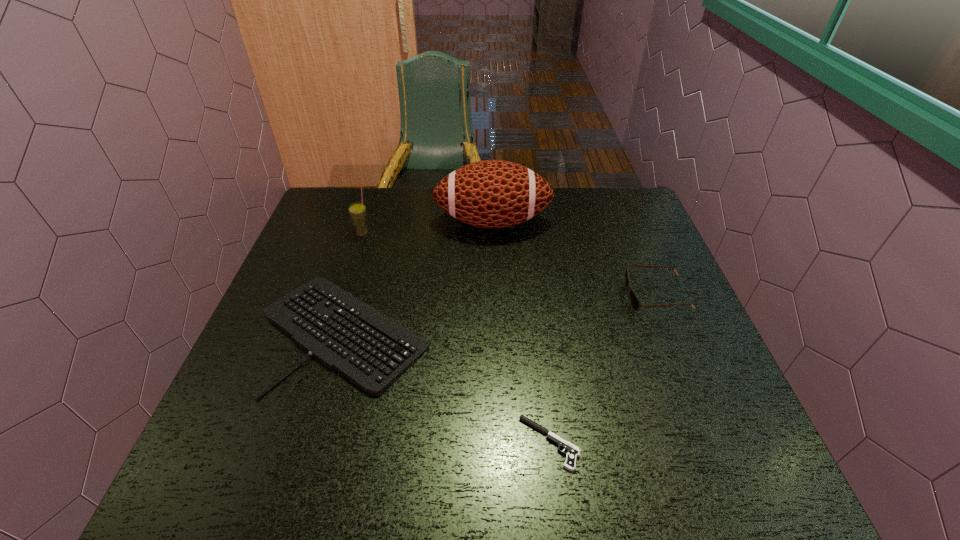
Where is `computer keyboard at the left edge`? The height and width of the screenshot is (540, 960). computer keyboard at the left edge is located at coordinates (370, 349).

I want to click on object that is at the right edge, so click(x=635, y=303).

What are the coordinates of `object situated at the far left corner` in the screenshot? It's located at (358, 213).

Where is `free space at the far edge`? The image size is (960, 540). free space at the far edge is located at coordinates (377, 218).

You are a GUI agent. You are given a task and a screenshot of the screen. Output one action in this format:
    pyautogui.click(x=<x>, y=<y>)
    Task: Click on the vacant space at the left edge of the desktop
    The width and height of the screenshot is (960, 540).
    Given the screenshot: What is the action you would take?
    pyautogui.click(x=334, y=244)

The width and height of the screenshot is (960, 540). In the image, there is a desktop. Identify the location of vacant area at the right edge. (696, 390).

The width and height of the screenshot is (960, 540). Identify the location of free space at the near left corner of the desktop. (227, 488).

The width and height of the screenshot is (960, 540). In order to click on vacant point at the far right corner in this screenshot , I will do point(601,192).

Locate an element on the screen. Image resolution: width=960 pixels, height=540 pixels. vacant space at the near right corner of the desktop is located at coordinates (728, 459).

I want to click on free space between the shortest object and the fourth shortest object, so click(x=456, y=339).